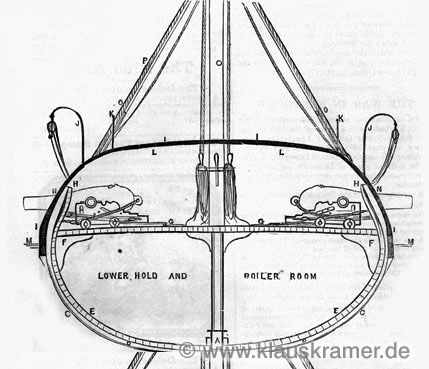
This screenshot has width=429, height=369. In order to click on room in this screenshot , I will do `click(299, 279)`.